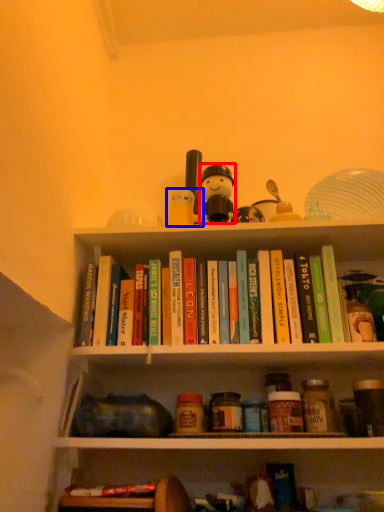
Question: Which object appears closest to the camera in this image, figurine (highlighted by a red box) or toy (highlighted by a blue box)?

Choices:
 (A) figurine
 (B) toy

Answer: (A)